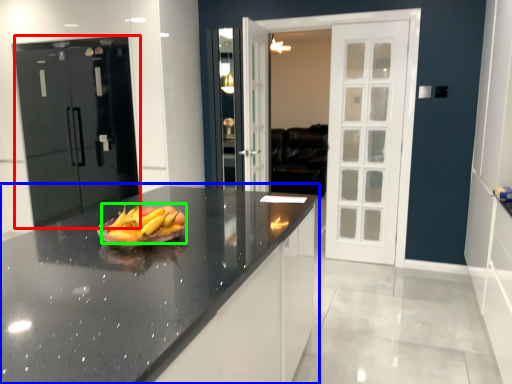
Question: Estimate the real-world distances between objects in this image. Which object is closer to door (highlighted by a red box), countertop (highlighted by a blue box) or grapefruit (highlighted by a green box)?

Choices:
 (A) countertop
 (B) grapefruit

Answer: (A)